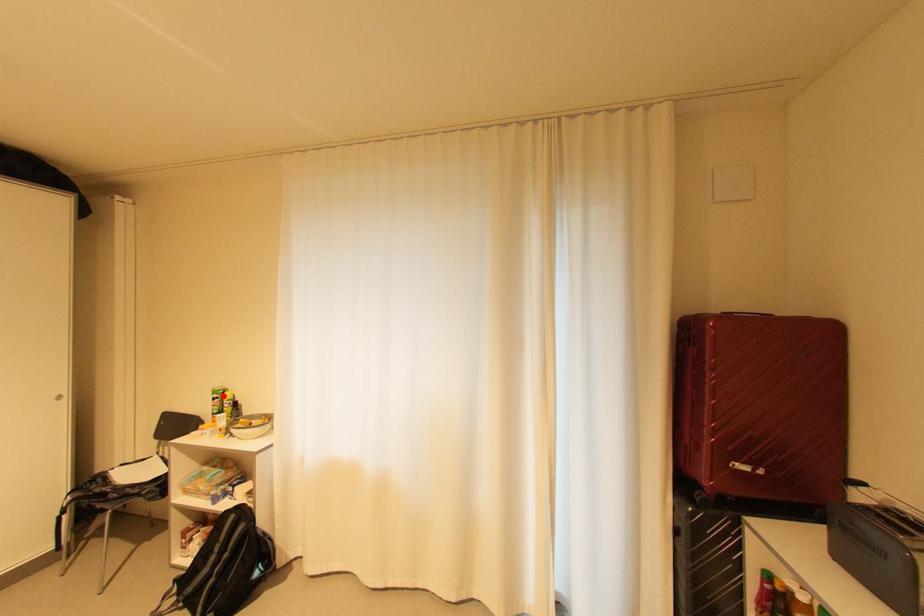
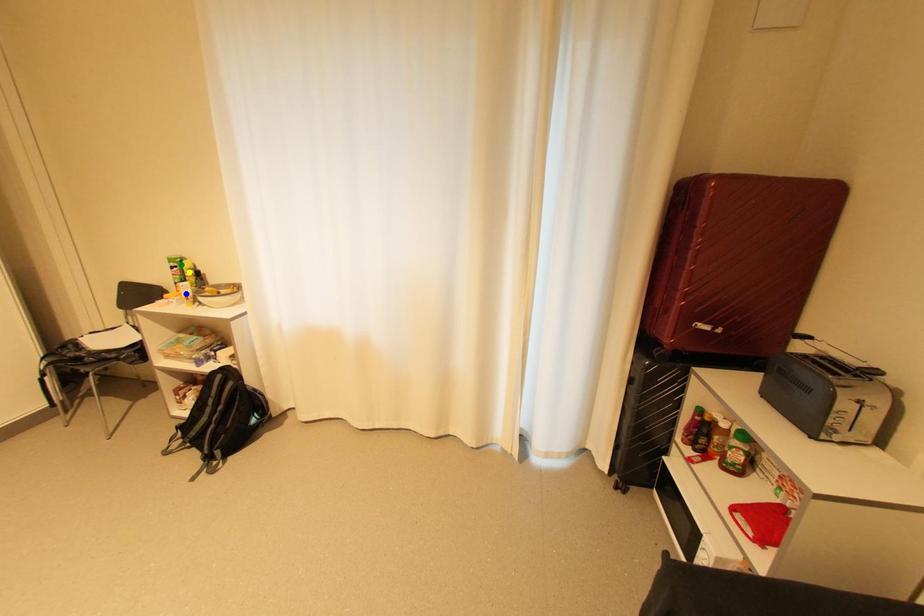
Question: I am providing you with two images of the same scene from different viewpoints. A red point is marked on the first image. You are given multiple points on the second image. Which point in image 2 represents the same 3d spot as the red point in image 1?

Choices:
 (A) yellow point
 (B) blue point
 (C) green point

Answer: (C)